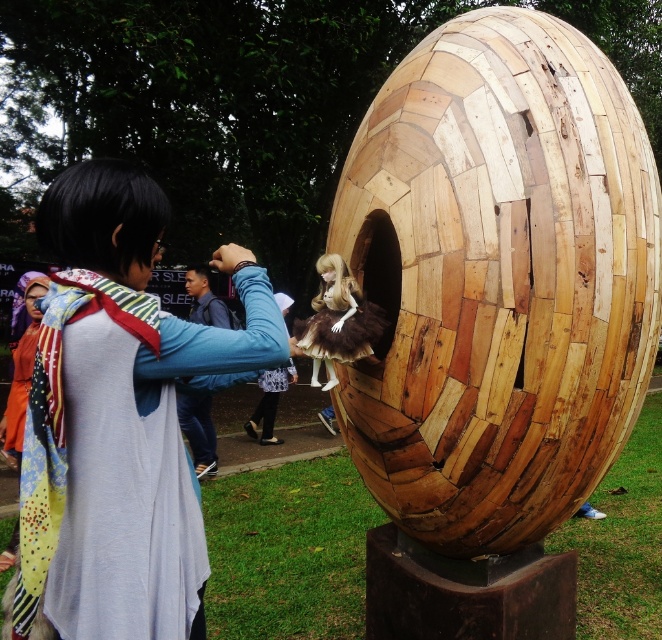
Question: Can you confirm if wooden egg at center is thinner than matte brown doll at center?

Choices:
 (A) yes
 (B) no

Answer: (B)

Question: Among these objects, which one is farthest from the camera?

Choices:
 (A) multicolored scarf at left
 (B) matte brown doll at center
 (C) wooden egg at center

Answer: (B)

Question: Can you confirm if wooden egg at center is thinner than matte brown doll at center?

Choices:
 (A) no
 (B) yes

Answer: (A)

Question: Which object is farther from the camera taking this photo?

Choices:
 (A) wooden egg at center
 (B) multicolored scarf at left
 (C) matte brown doll at center

Answer: (C)

Question: Which point appears farthest from the camera in this image?

Choices:
 (A) (561, 132)
 (B) (162, 429)

Answer: (A)

Question: In this image, where is multicolored scarf at left located relative to matte brown doll at center?

Choices:
 (A) below
 (B) above

Answer: (A)